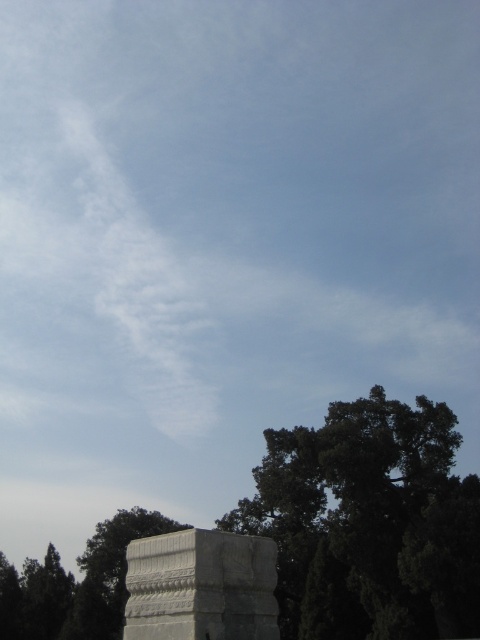
Can you confirm if green leafy tree at lower right is taller than green leafy tree at lower left?

No.

Is green leafy tree at lower right below green leafy tree at lower left?

Actually, green leafy tree at lower right is above green leafy tree at lower left.

What do you see at coordinates (369, 524) in the screenshot?
I see `green leafy tree at lower right` at bounding box center [369, 524].

Locate an element on the screen. green leafy tree at lower right is located at coordinates (369, 524).

Is point (347, 422) in front of point (132, 627)?

No, it is behind (132, 627).

Who is positioned more to the right, green leafy tree at lower right or white stone monument at lower center?

green leafy tree at lower right

You are a GUI agent. You are given a task and a screenshot of the screen. Output one action in this format:
    pyautogui.click(x=<x>, y=<y>)
    Task: Click on the green leafy tree at lower right
    This screenshot has width=480, height=640.
    Given the screenshot: What is the action you would take?
    pyautogui.click(x=369, y=524)

Who is higher up, white stone monument at lower center or green leafy tree at lower left?

white stone monument at lower center is above.

Does point (197, 602) come closer to viewer compared to point (82, 600)?

Yes.

Image resolution: width=480 pixels, height=640 pixels. What are the coordinates of `white stone monument at lower center` in the screenshot? It's located at (201, 586).